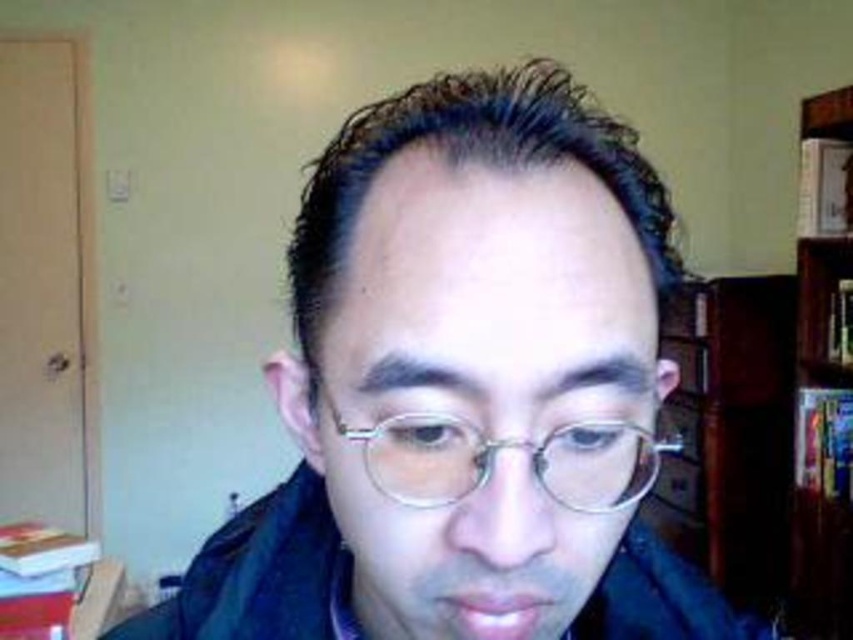
Question: Can you confirm if matte black glasses at center is smaller than wooden bookcase at right?

Choices:
 (A) yes
 (B) no

Answer: (B)

Question: Is clear plastic glasses at center bigger than wooden bookcase at right?

Choices:
 (A) yes
 (B) no

Answer: (B)

Question: Which of the following is the farthest from the observer?

Choices:
 (A) pos(357,330)
 (B) pos(430,460)
 (C) pos(820,577)

Answer: (C)

Question: Which point is closer to the camera?

Choices:
 (A) (846, 262)
 (B) (490, 468)
 (C) (227, 612)

Answer: (B)

Question: Does matte black glasses at center appear on the right side of wooden bookcase at right?

Choices:
 (A) yes
 (B) no

Answer: (B)

Question: Among these points, which one is farthest from the camera?

Choices:
 (A) (608, 506)
 (B) (822, 268)

Answer: (B)